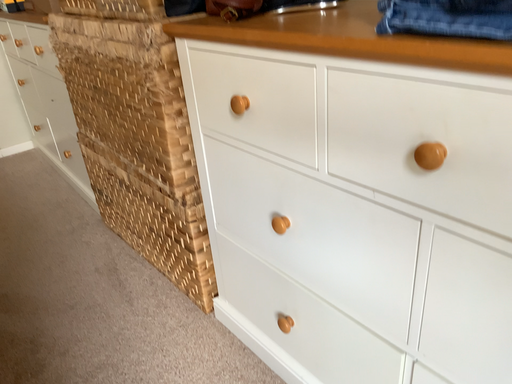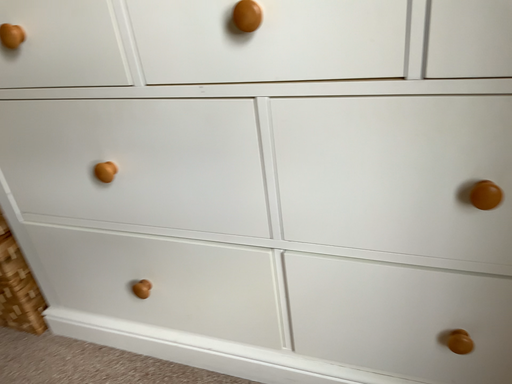
Question: Which way did the camera rotate in the video?

Choices:
 (A) rotated left
 (B) rotated right

Answer: (B)